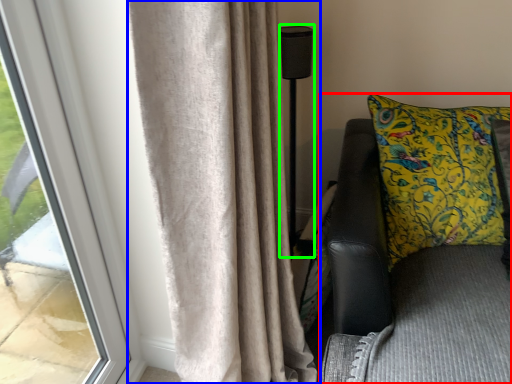
Question: Which object is the farthest from furniture (highlighted by a red box)? Choose among these: curtain (highlighted by a blue box) or lamp (highlighted by a green box).

Choices:
 (A) curtain
 (B) lamp

Answer: (B)